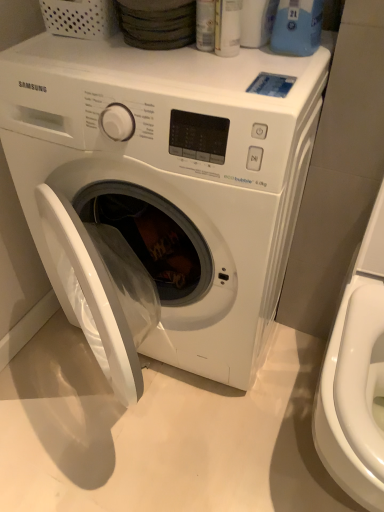
Image resolution: width=384 pixels, height=512 pixels. What are the coordinates of `free space that is in between white glossy washer at right and white glossy washing machine at center` in the screenshot? It's located at (268, 411).